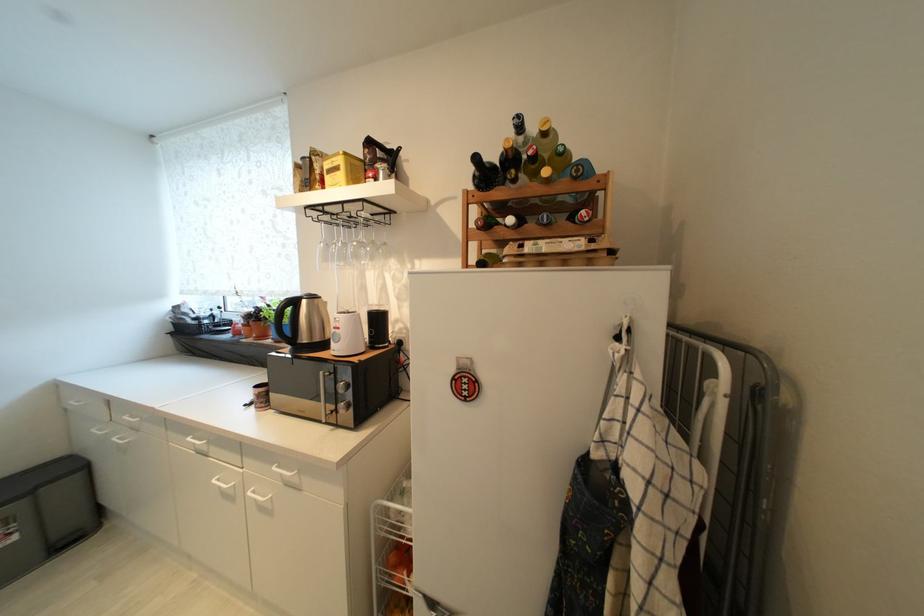
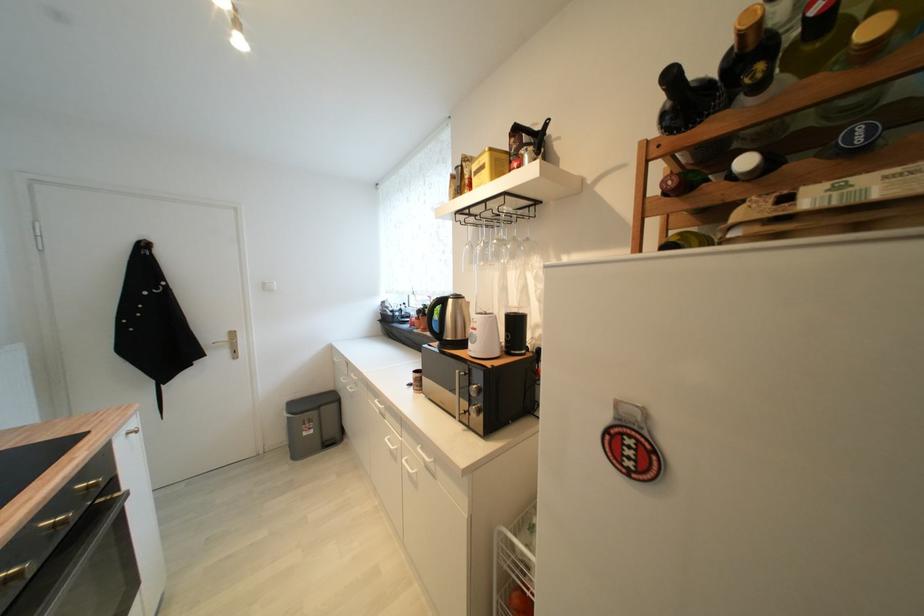
The point at (516, 222) is marked in the first image. Where is the corresponding point in the second image?

(751, 164)